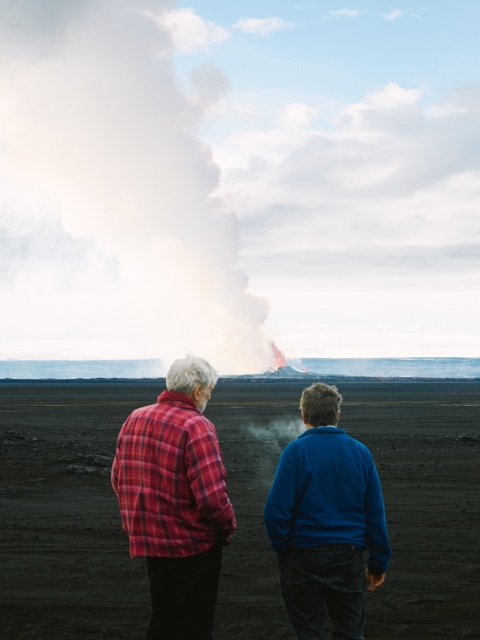
Looking at this image, you are a photographer trying to capture both the red plaid shirt at center and the blue fleece jacket at center in a single frame. Given their sizes, which one will appear closer to the camera in the photo?

The red plaid shirt at center is larger in size than the blue fleece jacket at center, so it will appear closer to the camera in the photo.

You are a photographer trying to capture the volcanic eruption. You notice two people in the scene wearing the plaid fabric shirt at center and the red plaid shirt at center. Which person should you focus on if you want to photograph someone positioned to the left side of the frame?

You should focus on the red plaid shirt at center because the plaid fabric shirt at center is to its right, making the red plaid shirt at center the one positioned to the left side of the frame.